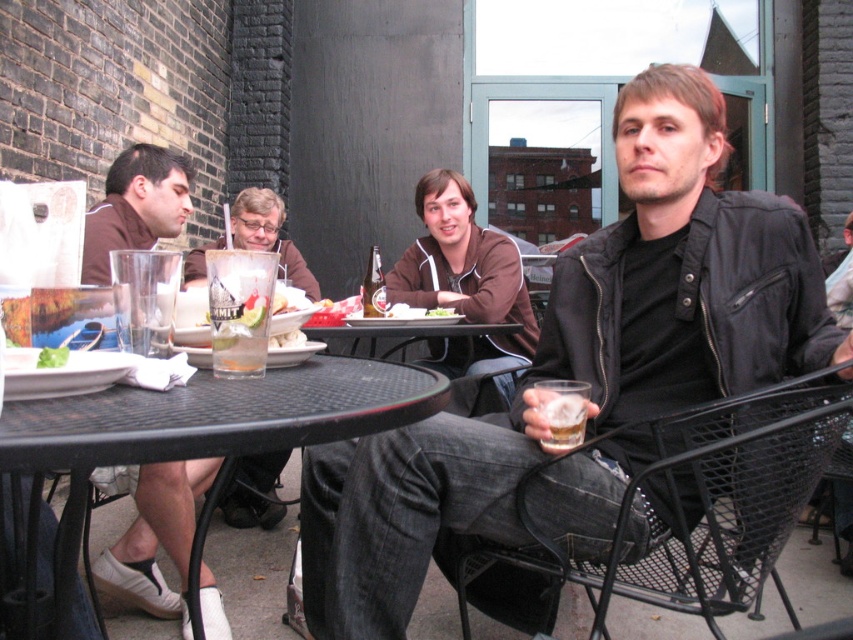
Question: Does brown leather jacket at left appear on the right side of translucent glass at lower right?

Choices:
 (A) yes
 (B) no

Answer: (B)

Question: Can you confirm if clear glass with ice at table left is bigger than green leafy vegetable at center?

Choices:
 (A) no
 (B) yes

Answer: (B)

Question: Which of these objects is positioned closest to the green leafy salad at center?

Choices:
 (A) translucent glass at lower right
 (B) brown fleece jacket at center
 (C) clear glass with ice at table left
 (D) clear glass beer at center

Answer: (D)

Question: Which of the following is the farthest from the observer?

Choices:
 (A) (218, 241)
 (B) (64, 417)
 (C) (480, 266)
 (D) (86, 228)

Answer: (A)

Question: Is the position of black mesh table at lower left more distant than that of brown leather jacket at left?

Choices:
 (A) yes
 (B) no

Answer: (B)

Question: Which object is positioned closest to the brown fleece jacket at center?

Choices:
 (A) clear glass beer at center
 (B) black mesh table at lower left

Answer: (A)